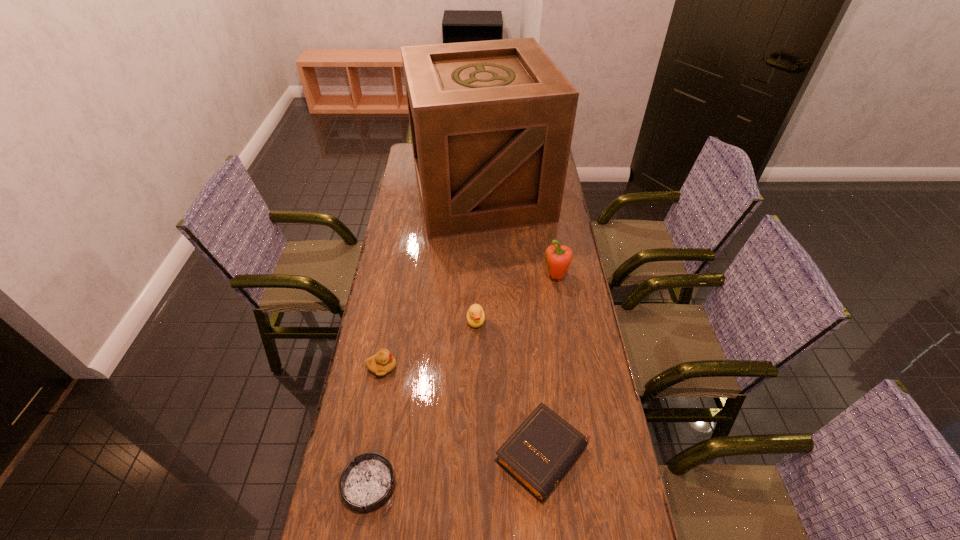
At what (x,y) coordinates should I click in order to perform the action: click on the farthest object. Please return your answer as a coordinate pair (x, y). The width and height of the screenshot is (960, 540). Looking at the image, I should click on (491, 122).

Image resolution: width=960 pixels, height=540 pixels. In order to click on box in this screenshot , I will do `click(491, 122)`.

Find the location of a particular element. the second farthest object is located at coordinates (558, 258).

At what (x,y) coordinates should I click in order to perform the action: click on the fifth shortest object. Please return your answer as a coordinate pair (x, y). Image resolution: width=960 pixels, height=540 pixels. Looking at the image, I should click on (558, 258).

Identify the location of the farther duckling. This screenshot has width=960, height=540. (475, 316).

At what (x,y) coordinates should I click in order to perform the action: click on the right duckling. Please return your answer as a coordinate pair (x, y). This screenshot has height=540, width=960. Looking at the image, I should click on (475, 316).

Find the location of `the nearer duckling`. the nearer duckling is located at coordinates (383, 362).

The height and width of the screenshot is (540, 960). What are the coordinates of `the left duckling` in the screenshot? It's located at click(x=383, y=362).

The image size is (960, 540). Identify the location of the second shortest object. (542, 449).

The width and height of the screenshot is (960, 540). In order to click on ashtray in this screenshot , I will do `click(367, 483)`.